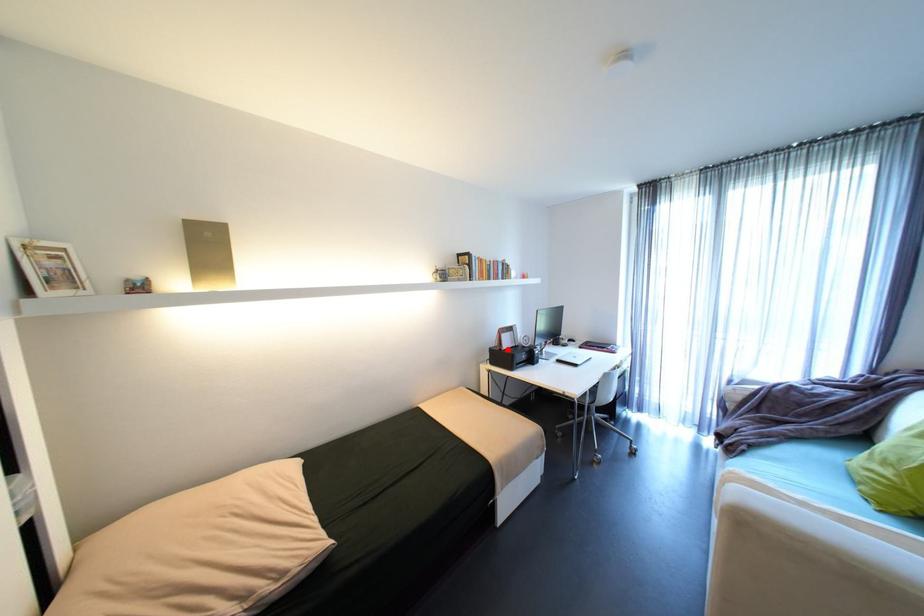
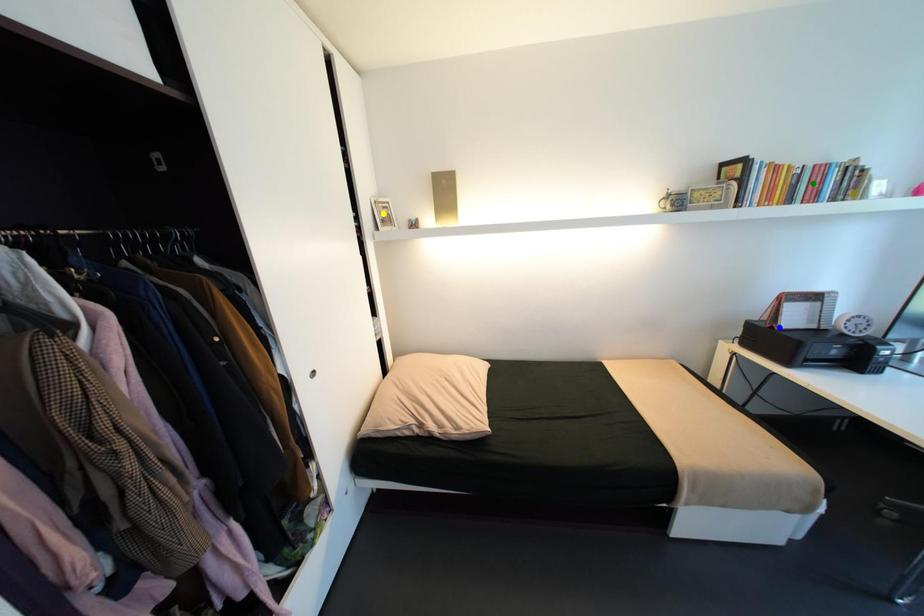
Question: I am providing you with two images of the same scene from different viewpoints. A red point is marked on the first image. You are given multiple points on the second image. Which mark in image 2 goes with the point in image 1?

Choices:
 (A) green point
 (B) yellow point
 (C) blue point

Answer: (C)